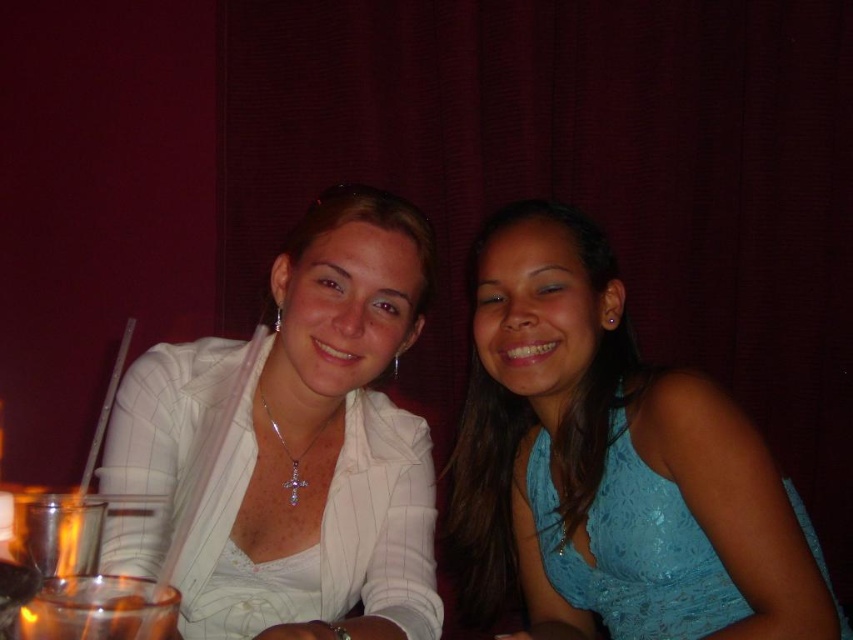
Question: Does blue lace dress at center have a lesser width compared to white glossy blazer at upper left?

Choices:
 (A) yes
 (B) no

Answer: (B)

Question: Where is blue lace dress at center located in relation to white glossy blazer at upper left in the image?

Choices:
 (A) left
 (B) right

Answer: (B)

Question: Which point appears closest to the camera in this image?

Choices:
 (A) (x=309, y=244)
 (B) (x=654, y=637)

Answer: (A)

Question: Among these points, which one is farthest from the camera?

Choices:
 (A) (456, 557)
 (B) (344, 321)

Answer: (A)

Question: Considering the relative positions of blue lace dress at center and white glossy blazer at upper left in the image provided, where is blue lace dress at center located with respect to white glossy blazer at upper left?

Choices:
 (A) above
 (B) below

Answer: (B)